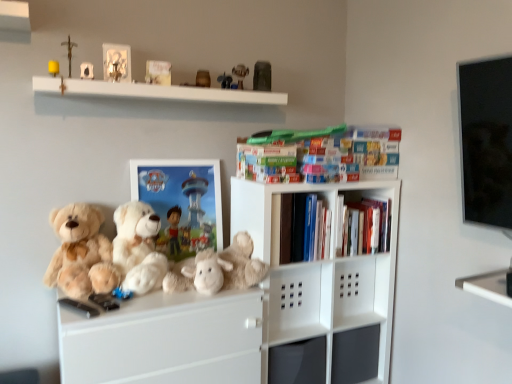
What are the coordinates of `metallic gray figurine at upper center, the first toy in the right-to-left sequence` in the screenshot? It's located at (262, 76).

The image size is (512, 384). Identify the location of soft plush teddy bear at left, arranged as the second teddy bear when viewed from the right. (81, 253).

This screenshot has height=384, width=512. What do you see at coordinates (86, 70) in the screenshot?
I see `matte white photo frame at upper center, which is counted as the 6th toy, starting from the right` at bounding box center [86, 70].

You are a GUI agent. You are given a task and a screenshot of the screen. Output one action in this format:
    pyautogui.click(x=<x>, y=<y>)
    Task: Click on the matte cardboard book at upper center, placed as the 1th book when sorted from left to right
    
    Given the screenshot: What is the action you would take?
    pyautogui.click(x=158, y=72)

What is the approximate height of fluffy white teddy bear at center, which appears as the 1th teddy bear when viewed from the right?

Answer: It is 14.96 inches.

Locate an element on the screen. The width and height of the screenshot is (512, 384). plush toy at upper center, which is the second toy in right-to-left order is located at coordinates (240, 74).

Where is `hardcover books at upper center, which is counted as the second book, starting from the left`? Image resolution: width=512 pixels, height=384 pixels. hardcover books at upper center, which is counted as the second book, starting from the left is located at coordinates (267, 163).

Can we say matte white photo frame at upper center, the 3th toy positioned from the left, lies outside metallic figurine at upper center, arranged as the 4th toy when viewed from the left?

Yes.

Which is more to the right, matte white photo frame at upper center, the 3th toy positioned from the left, or metallic figurine at upper center, arranged as the 4th toy when viewed from the left?

From the viewer's perspective, metallic figurine at upper center, arranged as the 4th toy when viewed from the left, appears more on the right side.

Does matte white photo frame at upper center, the 3th toy positioned from the left, have a lesser height compared to metallic figurine at upper center, positioned as the fifth toy in right-to-left order?

Yes, matte white photo frame at upper center, the 3th toy positioned from the left, is shorter than metallic figurine at upper center, positioned as the fifth toy in right-to-left order.

Is matte white photo frame at upper center, the 3th toy positioned from the left, in front of metallic figurine at upper center, positioned as the fifth toy in right-to-left order?

Yes, it is in front of metallic figurine at upper center, positioned as the fifth toy in right-to-left order.

Is fluffy white teddy bear at center, which appears as the 1th teddy bear when viewed from the right, inside yellow matte candle at upper left, the 1th toy positioned from the left?

No, fluffy white teddy bear at center, which appears as the 1th teddy bear when viewed from the right, is not inside yellow matte candle at upper left, the 1th toy positioned from the left.

What's the angular difference between yellow matte candle at upper left, the 8th toy viewed from the right, and fluffy white teddy bear at center, the second teddy bear positioned from the left,'s facing directions?

They differ by 3.43 degrees in their facing directions.

Is yellow matte candle at upper left, the 8th toy viewed from the right, positioned before fluffy white teddy bear at center, which appears as the 1th teddy bear when viewed from the right?

No, yellow matte candle at upper left, the 8th toy viewed from the right, is further to the viewer.

Find the location of a particular element. Image resolution: width=512 pixels, height=384 pixels. the 5th toy to the right when counting from the yellow matte candle at upper left, the 8th toy viewed from the right is located at coordinates (225, 80).

Is yellow matte candle at upper left, the 1th toy positioned from the left, facing away from matte plastic toy at upper center, marked as the sixth toy in a left-to-right arrangement?

yellow matte candle at upper left, the 1th toy positioned from the left, is not turned away from matte plastic toy at upper center, marked as the sixth toy in a left-to-right arrangement.

Is matte plastic toy at upper center, which is the third toy in right-to-left order, completely or partially inside yellow matte candle at upper left, the 1th toy positioned from the left?

No, matte plastic toy at upper center, which is the third toy in right-to-left order, is not surrounded by yellow matte candle at upper left, the 1th toy positioned from the left.

Considering the positions of objects yellow matte candle at upper left, the 1th toy positioned from the left, and matte plastic toy at upper center, which is the third toy in right-to-left order, in the image provided, who is in front, yellow matte candle at upper left, the 1th toy positioned from the left, or matte plastic toy at upper center, which is the third toy in right-to-left order,?

yellow matte candle at upper left, the 1th toy positioned from the left, is closer to the camera.

Is metal crucifix at upper left, the 2th toy from the left, bigger than metallic figurine at upper center, arranged as the 4th toy when viewed from the left?

Indeed, metal crucifix at upper left, the 2th toy from the left, has a larger size compared to metallic figurine at upper center, arranged as the 4th toy when viewed from the left.

From the image's perspective, is metal crucifix at upper left, which ranks as the 7th toy in right-to-left order, located above or below metallic figurine at upper center, positioned as the fifth toy in right-to-left order?

From the image's perspective, metal crucifix at upper left, which ranks as the 7th toy in right-to-left order, appears above metallic figurine at upper center, positioned as the fifth toy in right-to-left order.

How many degrees apart are the facing directions of soft plush teddy bear at left, which is the first teddy bear in left-to-right order, and metallic gray figurine at upper center, the first toy in the right-to-left sequence?

The facing directions of soft plush teddy bear at left, which is the first teddy bear in left-to-right order, and metallic gray figurine at upper center, the first toy in the right-to-left sequence, are 6.96 degrees apart.

Considering the relative sizes of soft plush teddy bear at left, arranged as the second teddy bear when viewed from the right, and metallic gray figurine at upper center, the 8th toy when ordered from left to right, in the image provided, is soft plush teddy bear at left, arranged as the second teddy bear when viewed from the right, smaller than metallic gray figurine at upper center, the 8th toy when ordered from left to right,?

Incorrect, soft plush teddy bear at left, arranged as the second teddy bear when viewed from the right, is not smaller in size than metallic gray figurine at upper center, the 8th toy when ordered from left to right.

Is the depth of soft plush teddy bear at left, which is the first teddy bear in left-to-right order, less than that of metallic gray figurine at upper center, the 8th toy when ordered from left to right?

Yes, the depth of soft plush teddy bear at left, which is the first teddy bear in left-to-right order, is less than that of metallic gray figurine at upper center, the 8th toy when ordered from left to right.

Are soft plush teddy bear at left, which is the first teddy bear in left-to-right order, and metallic gray figurine at upper center, the 8th toy when ordered from left to right, making contact?

soft plush teddy bear at left, which is the first teddy bear in left-to-right order, and metallic gray figurine at upper center, the 8th toy when ordered from left to right, are not in contact.

Is yellow matte candle at upper left, the 8th toy viewed from the right, thinner than hardcover books at upper center, which is counted as the second book, starting from the left?

Correct, the width of yellow matte candle at upper left, the 8th toy viewed from the right, is less than that of hardcover books at upper center, which is counted as the second book, starting from the left.

From the image's perspective, is yellow matte candle at upper left, the 1th toy positioned from the left, beneath hardcover books at upper center, marked as the second book in a bottom-to-top arrangement?

Actually, yellow matte candle at upper left, the 1th toy positioned from the left, appears above hardcover books at upper center, marked as the second book in a bottom-to-top arrangement, in the image.

Would you say yellow matte candle at upper left, the 8th toy viewed from the right, is a long distance from hardcover books at upper center, marked as the 2th book in a top-to-bottom arrangement?

No, yellow matte candle at upper left, the 8th toy viewed from the right, is in close proximity to hardcover books at upper center, marked as the 2th book in a top-to-bottom arrangement.

Could you tell me if yellow matte candle at upper left, the 1th toy positioned from the left, is facing hardcover books at upper center, which is counted as the second book, starting from the left?

No, yellow matte candle at upper left, the 1th toy positioned from the left, is not oriented towards hardcover books at upper center, which is counted as the second book, starting from the left.

From the picture: Is plush toy at upper center, placed as the seventh toy when sorted from left to right, taller or shorter than metallic figurine at upper center, arranged as the 4th toy when viewed from the left?

In the image, plush toy at upper center, placed as the seventh toy when sorted from left to right, appears to be taller than metallic figurine at upper center, arranged as the 4th toy when viewed from the left.

Which toy is the 3rd one when counting from the right side of the metallic figurine at upper center, arranged as the 4th toy when viewed from the left? Please provide its 2D coordinates.

[(240, 74)]

From the image's perspective, between plush toy at upper center, which is the second toy in right-to-left order, and metallic figurine at upper center, positioned as the fifth toy in right-to-left order, who is located below?

metallic figurine at upper center, positioned as the fifth toy in right-to-left order, from the image's perspective.

How different are the orientations of plush toy at upper center, placed as the seventh toy when sorted from left to right, and metallic figurine at upper center, arranged as the 4th toy when viewed from the left, in degrees?

The angular difference between plush toy at upper center, placed as the seventh toy when sorted from left to right, and metallic figurine at upper center, arranged as the 4th toy when viewed from the left, is 6.97 degrees.

Where is `toy that is the 2nd object located below the metallic figurine at upper center, arranged as the 4th toy when viewed from the left (from the image's perspective)`? toy that is the 2nd object located below the metallic figurine at upper center, arranged as the 4th toy when viewed from the left (from the image's perspective) is located at coordinates (86, 70).

You are a GUI agent. You are given a task and a screenshot of the screen. Output one action in this format:
    pyautogui.click(x=<x>, y=<y>)
    Task: Click on the 2nd teddy bear counting from the right of the yellow matte candle at upper left, the 8th toy viewed from the right
    
    Given the screenshot: What is the action you would take?
    pyautogui.click(x=138, y=248)

Considering their positions, is plush toy at upper center, placed as the seventh toy when sorted from left to right, positioned further to matte brown figurine at upper center, the fourth toy when ordered from right to left, than soft plush teddy bear at left, which is the first teddy bear in left-to-right order?

soft plush teddy bear at left, which is the first teddy bear in left-to-right order, is positioned further to the anchor matte brown figurine at upper center, the fourth toy when ordered from right to left.

From the image, which object appears to be nearer to soft plush teddy bear at left, arranged as the second teddy bear when viewed from the right, matte cardboard book at upper center, which appears as the 3th book when ordered from the bottom, or matte white photo frame at upper center, the 3th toy positioned from the left?

matte white photo frame at upper center, the 3th toy positioned from the left, is closer to soft plush teddy bear at left, arranged as the second teddy bear when viewed from the right.

When comparing their distances from hardcover books at center, placed as the first book when sorted from bottom to top, does plush toy at upper center, placed as the seventh toy when sorted from left to right, or metallic gray figurine at upper center, the first toy in the right-to-left sequence, seem closer?

Based on the image, metallic gray figurine at upper center, the first toy in the right-to-left sequence, appears to be nearer to hardcover books at center, placed as the first book when sorted from bottom to top.

From the image, which object appears to be farther from metallic figurine at upper center, arranged as the 4th toy when viewed from the left, matte brown figurine at upper center, arranged as the fifth toy when viewed from the left, or metallic gray figurine at upper center, the first toy in the right-to-left sequence?

The object further to metallic figurine at upper center, arranged as the 4th toy when viewed from the left, is metallic gray figurine at upper center, the first toy in the right-to-left sequence.

Estimate the real-world distances between objects in this image. Which object is closer to yellow matte candle at upper left, the 8th toy viewed from the right, fluffy white teddy bear at center, the second teddy bear positioned from the left, or hardcover books at center, which is the 3th book from top to bottom?

fluffy white teddy bear at center, the second teddy bear positioned from the left.

Which object lies further to the anchor point matte cardboard book at upper center, marked as the 3th book in a right-to-left arrangement, metallic figurine at upper center, arranged as the 4th toy when viewed from the left, or soft plush teddy bear at left, arranged as the second teddy bear when viewed from the right?

Among the two, soft plush teddy bear at left, arranged as the second teddy bear when viewed from the right, is located further to matte cardboard book at upper center, marked as the 3th book in a right-to-left arrangement.

Based on their spatial positions, is matte white photo frame at upper center, which is counted as the 6th toy, starting from the right, or fluffy white teddy bear at center, the second teddy bear positioned from the left, further from matte cardboard book at upper center, acting as the first book starting from the top?

Based on the image, fluffy white teddy bear at center, the second teddy bear positioned from the left, appears to be further to matte cardboard book at upper center, acting as the first book starting from the top.

Based on their spatial positions, is hardcover books at center, the 1th book positioned from the right, or matte plastic picture frame at center closer to matte cardboard book at upper center, which appears as the 3th book when ordered from the bottom?

matte plastic picture frame at center is positioned closer to the anchor matte cardboard book at upper center, which appears as the 3th book when ordered from the bottom.

This screenshot has width=512, height=384. Find the location of `book located between matte white photo frame at upper center, which is counted as the 6th toy, starting from the right, and hardcover books at upper center, marked as the 2th book in a top-to-bottom arrangement, in the left-right direction`. book located between matte white photo frame at upper center, which is counted as the 6th toy, starting from the right, and hardcover books at upper center, marked as the 2th book in a top-to-bottom arrangement, in the left-right direction is located at coordinates (158, 72).

Find the location of `book between matte cardboard book at upper center, marked as the 3th book in a right-to-left arrangement, and matte plastic picture frame at center from top to bottom`. book between matte cardboard book at upper center, marked as the 3th book in a right-to-left arrangement, and matte plastic picture frame at center from top to bottom is located at coordinates click(267, 163).

Locate an element on the screen. picture frame between yellow matte candle at upper left, the 8th toy viewed from the right, and soft plush teddy bear at left, arranged as the second teddy bear when viewed from the right, vertically is located at coordinates (181, 203).

The image size is (512, 384). Identify the location of teddy bear between matte plastic toy at upper center, marked as the sixth toy in a left-to-right arrangement, and soft plush teddy bear at left, arranged as the second teddy bear when viewed from the right, from top to bottom. (138, 248).